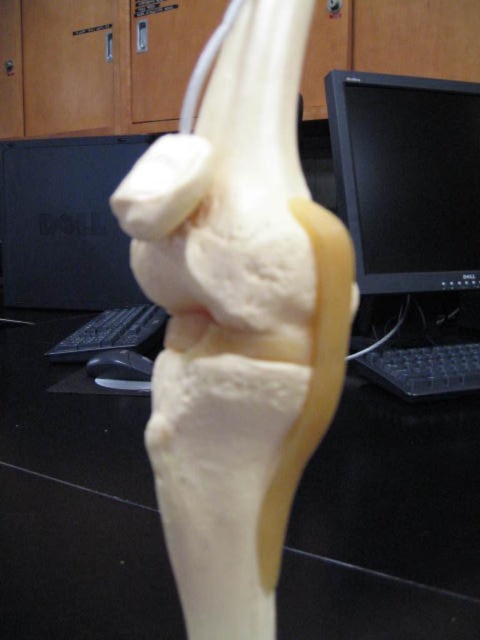
At what (x,y) coordinates should I click in order to perform the action: click on black plastic keyboard at center. Please return your answer as a coordinate pair (x, y). The image size is (480, 640). Looking at the image, I should click on (75, 502).

Locate an element on the screen. The width and height of the screenshot is (480, 640). black plastic keyboard at center is located at coordinates (75, 502).